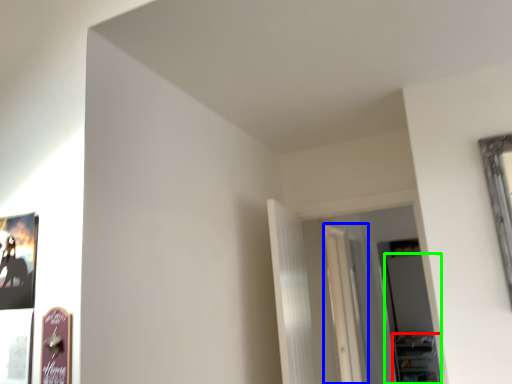
Question: Based on their relative distances, which object is farther from shelf (highlighted by a red box)? Choose from glass door (highlighted by a blue box) and glass door (highlighted by a green box).

Choices:
 (A) glass door
 (B) glass door

Answer: (A)